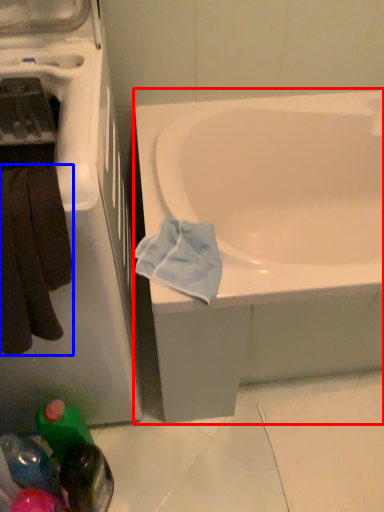
Question: Which object is further to the camera taking this photo, bathtub (highlighted by a red box) or towel/napkin (highlighted by a blue box)?

Choices:
 (A) bathtub
 (B) towel/napkin

Answer: (A)